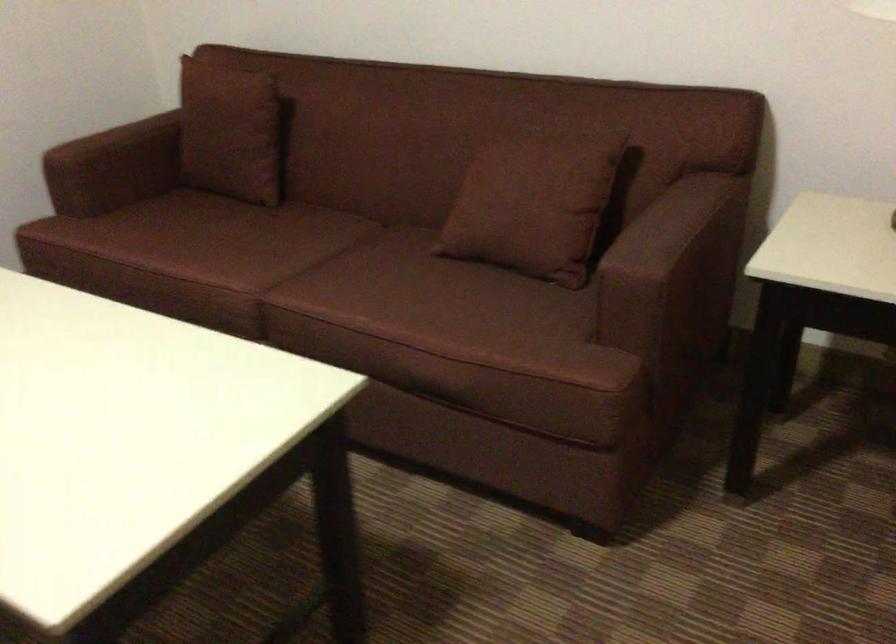
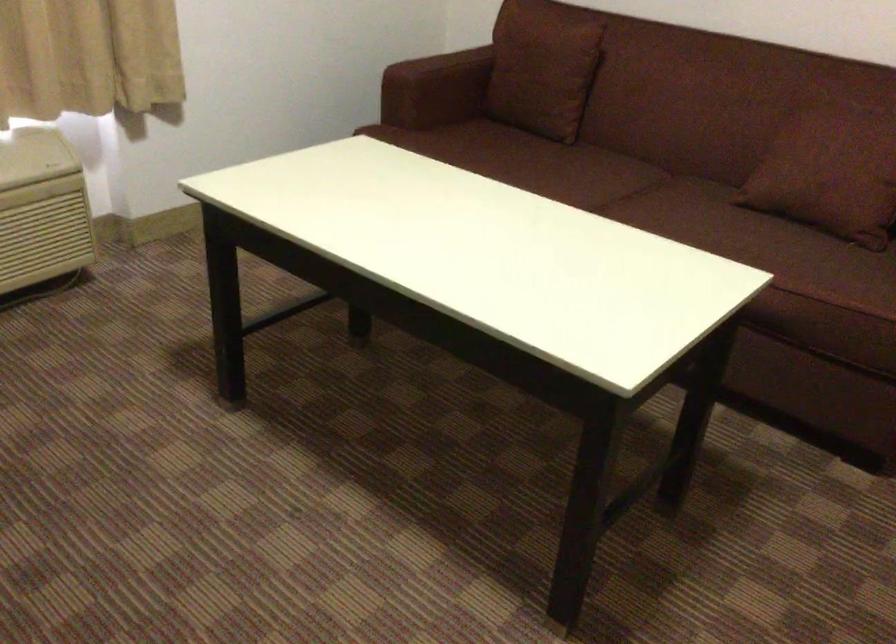
Where in the second image is the point corresponding to (x=227, y=129) from the first image?

(543, 69)